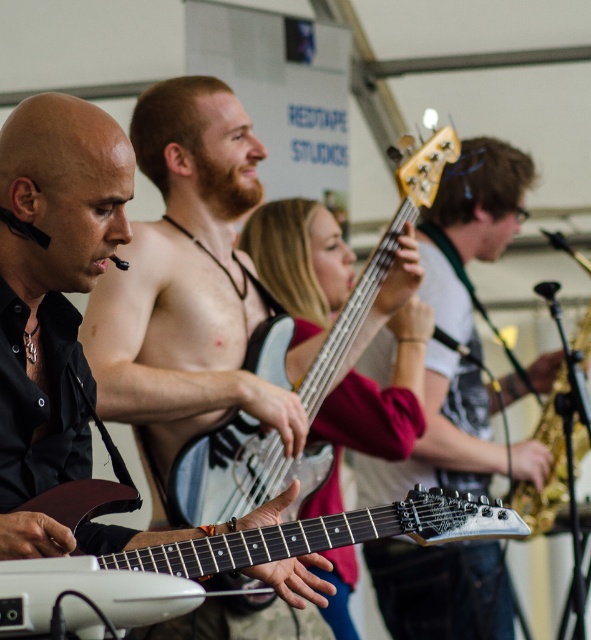
Does point (427, 548) lie behind point (246, 499)?

That is True.

Can you confirm if matte white bass guitar at center is positioned to the right of white glossy electric guitar at center?

Correct, you'll find matte white bass guitar at center to the right of white glossy electric guitar at center.

Who is more forward, (x=374, y=481) or (x=307, y=397)?

Positioned in front is point (x=307, y=397).

Locate an element on the screen. matte white bass guitar at center is located at coordinates (470, 227).

Is white matte electric guitar at center thinner than white glossy electric guitar at center?

No.

Between white matte electric guitar at center and white glossy electric guitar at center, which one has less height?

With less height is white matte electric guitar at center.

Identify the location of white matte electric guitar at center. The height and width of the screenshot is (640, 591). (272, 548).

Is matte white bass guitar at center above white matte electric guitar at center?

Correct, matte white bass guitar at center is located above white matte electric guitar at center.

Does matte white bass guitar at center come behind white matte electric guitar at center?

Yes, matte white bass guitar at center is behind white matte electric guitar at center.

Who is more distant from viewer, (478, 602) or (30, 500)?

The point (478, 602) is behind.

Image resolution: width=591 pixels, height=640 pixels. What are the coordinates of `matte white bass guitar at center` in the screenshot? It's located at (470, 227).